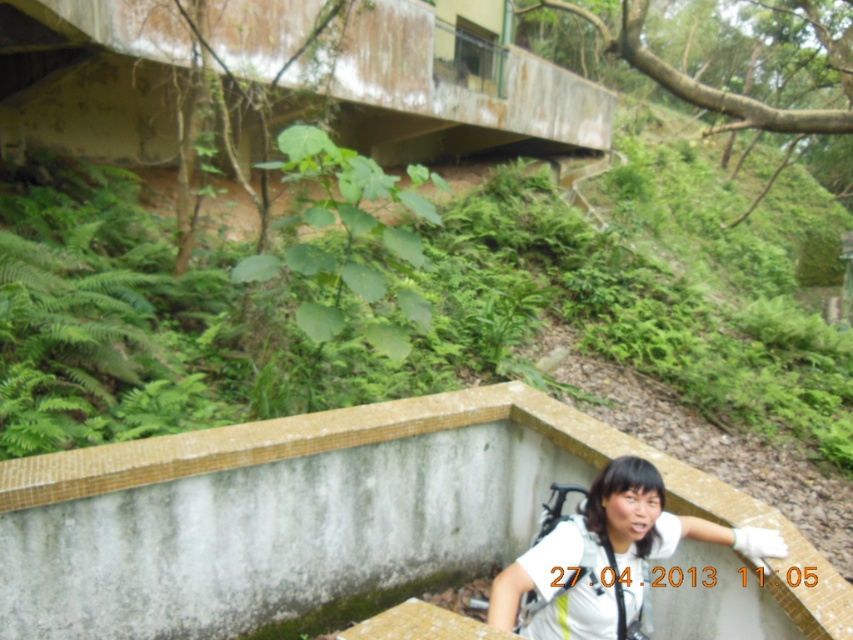
Question: Which point is farther to the camera?

Choices:
 (A) white matte shirt at lower center
 (B) white mosaic ledge at lower center

Answer: (B)

Question: Does white mosaic ledge at lower center appear over white matte shirt at lower center?

Choices:
 (A) no
 (B) yes

Answer: (A)

Question: Does white mosaic ledge at lower center have a smaller size compared to white matte shirt at lower center?

Choices:
 (A) yes
 (B) no

Answer: (B)

Question: Does white mosaic ledge at lower center appear on the right side of white matte shirt at lower center?

Choices:
 (A) no
 (B) yes

Answer: (A)